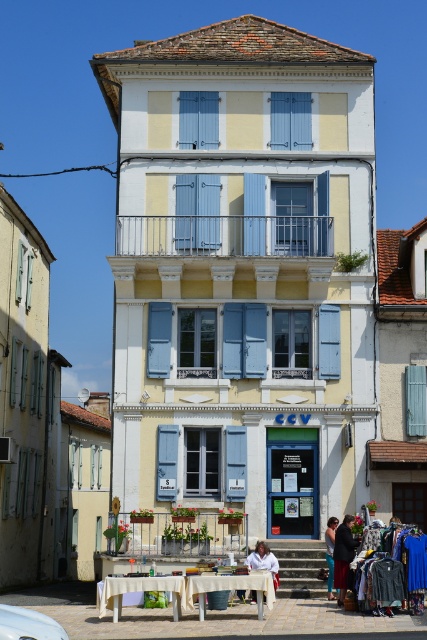
In the scene shown: Is matte glass window at center wider than dark blue fabric coat at center?

Yes.

Is matte glass window at center above dark blue fabric coat at center?

Yes, matte glass window at center is above dark blue fabric coat at center.

Who is more forward, (294,531) or (330,545)?

Positioned in front is point (330,545).

Identify the location of matte glass window at center. (292, 481).

Between point (11, 609) and point (330, 522), which one is positioned in front?

Point (11, 609) is in front.

Is white matte car at lower left behind dark blue fabric coat at center?

No.

Which is behind, point (40, 632) or point (332, 577)?

The point (332, 577) is behind.

The height and width of the screenshot is (640, 427). Identify the location of white matte car at lower left. (28, 625).

Does matte glass window at center have a lesser height compared to white fabric at lower center?

No.

Does point (292, 490) come farther from viewer compared to point (266, 556)?

Yes, it is.

Is point (309, 528) more distant than point (274, 570)?

Yes, point (309, 528) is behind point (274, 570).

What are the coordinates of `matte glass window at center` in the screenshot? It's located at (292, 481).